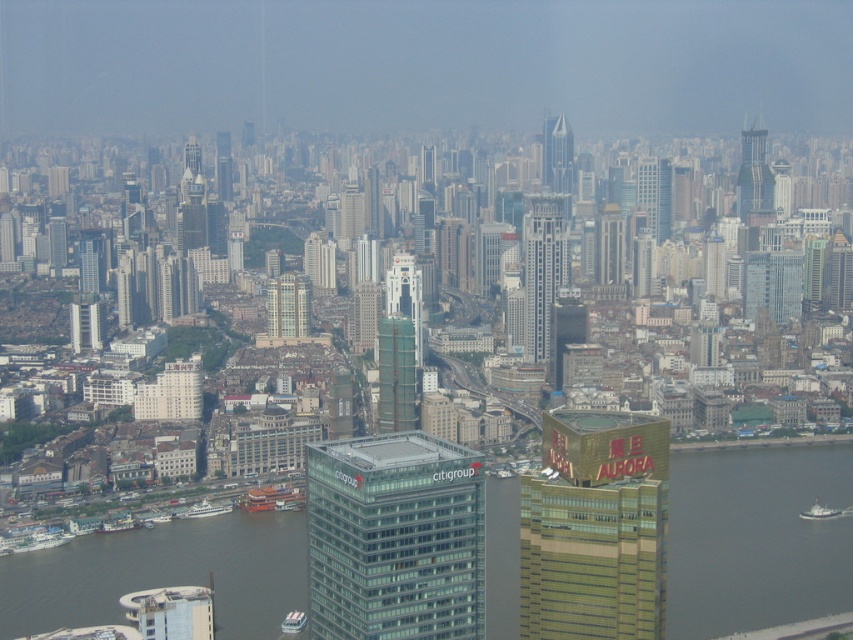
Question: Which object is positioned farthest from the shiny glass skyscraper at upper center?

Choices:
 (A) green glass skyscraper at center
 (B) glassy gray skyscraper at center
 (C) gold glass building at center-right

Answer: (B)

Question: Is glassy gray skyscraper at center further to camera compared to white glass building at center?

Choices:
 (A) no
 (B) yes

Answer: (A)

Question: Which point is closer to the camera?

Choices:
 (A) [x=556, y=573]
 (B) [x=842, y=588]
 (C) [x=660, y=218]

Answer: (A)

Question: Does brown water at lower center have a lesser width compared to glassy reflective skyscraper at upper right?

Choices:
 (A) no
 (B) yes

Answer: (A)

Question: Does gold reflective skyscraper at center appear on the left side of white glossy ferry at lower left?

Choices:
 (A) yes
 (B) no

Answer: (B)

Question: Which object appears farthest from the camera in this image?

Choices:
 (A) white plastic boat at lower center
 (B) silver glass skyscraper at center

Answer: (B)